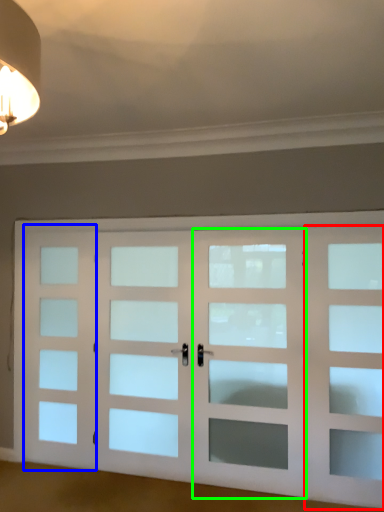
Question: Based on their relative distances, which object is farther from screen door (highlighted by a red box)? Choose from screen door (highlighted by a blue box) and screen door (highlighted by a green box).

Choices:
 (A) screen door
 (B) screen door

Answer: (A)